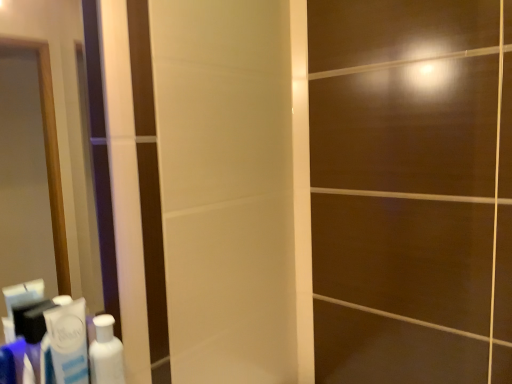
Question: Does white glossy toothpaste at lower left lie behind white glossy bottle at lower left?

Choices:
 (A) yes
 (B) no

Answer: (B)

Question: Is white glossy toothpaste at lower left aimed at white glossy bottle at lower left?

Choices:
 (A) yes
 (B) no

Answer: (B)

Question: From a real-world perspective, is white glossy toothpaste at lower left below white glossy bottle at lower left?

Choices:
 (A) yes
 (B) no

Answer: (B)

Question: Does white glossy toothpaste at lower left have a lesser width compared to white glossy bottle at lower left?

Choices:
 (A) yes
 (B) no

Answer: (A)

Question: From the image's perspective, would you say white glossy toothpaste at lower left is positioned over white glossy bottle at lower left?

Choices:
 (A) no
 (B) yes

Answer: (B)

Question: Does white glossy toothpaste at lower left lie in front of white glossy bottle at lower left?

Choices:
 (A) yes
 (B) no

Answer: (A)

Question: Can you confirm if white glossy bottle at lower left is positioned to the left of white glossy toothpaste at lower left?

Choices:
 (A) yes
 (B) no

Answer: (B)

Question: From a real-world perspective, is white glossy bottle at lower left on white glossy toothpaste at lower left?

Choices:
 (A) yes
 (B) no

Answer: (B)

Question: Considering the relative positions of white glossy bottle at lower left and white glossy toothpaste at lower left in the image provided, is white glossy bottle at lower left in front of white glossy toothpaste at lower left?

Choices:
 (A) yes
 (B) no

Answer: (B)

Question: Does white glossy bottle at lower left touch white glossy toothpaste at lower left?

Choices:
 (A) yes
 (B) no

Answer: (A)

Question: Is white glossy bottle at lower left smaller than white glossy toothpaste at lower left?

Choices:
 (A) yes
 (B) no

Answer: (A)

Question: Is white glossy bottle at lower left aimed at white glossy toothpaste at lower left?

Choices:
 (A) yes
 (B) no

Answer: (B)

Question: In the image, is white glossy bottle at lower left positioned in front of or behind white glossy toothpaste at lower left?

Choices:
 (A) front
 (B) behind

Answer: (B)